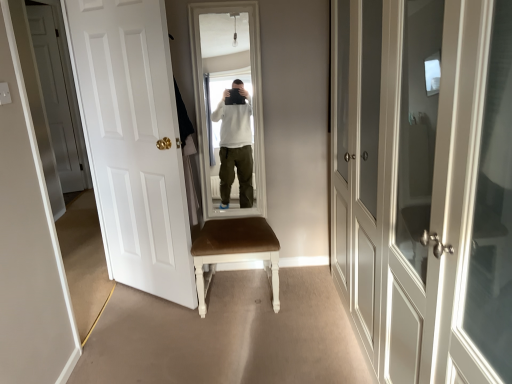
You are a GUI agent. You are given a task and a screenshot of the screen. Output one action in this format:
    pyautogui.click(x=<x>, y=<y>)
    Task: Click on the white glossy cabinet doors at right, placed as the first door when sorted from right to left
    Image resolution: width=512 pixels, height=384 pixels.
    Given the screenshot: What is the action you would take?
    pyautogui.click(x=424, y=185)

Identify the location of white glossy door at left, which ranks as the 2th door in front-to-back order. (133, 142).

Locate an element on the screen. The height and width of the screenshot is (384, 512). white matte door at left, acting as the first door starting from the back is located at coordinates (59, 95).

Is white glossy cabinet doors at right, which is the third door in back-to-front order, at the back of white glossy door at left, marked as the second door in a right-to-left arrangement?

No, white glossy door at left, marked as the second door in a right-to-left arrangement, is not facing the opposite direction of white glossy cabinet doors at right, which is the third door in back-to-front order.

Is white glossy door at left, the 2th door in the left-to-right sequence, to the left or to the right of white glossy cabinet doors at right, placed as the first door when sorted from front to back, in the image?

white glossy door at left, the 2th door in the left-to-right sequence, is positioned on white glossy cabinet doors at right, placed as the first door when sorted from front to back,'s left side.

Could you measure the distance between white glossy door at left, marked as the second door in a right-to-left arrangement, and white glossy cabinet doors at right, placed as the first door when sorted from front to back?

They are 1.32 meters apart.

Can you confirm if white glossy door at left, marked as the second door in a right-to-left arrangement, is taller than white glossy cabinet doors at right, the 3th door positioned from the left?

Yes.

Can you confirm if white glossy cabinet doors at right, placed as the first door when sorted from right to left, is taller than white matte door at left, which is the third door in right-to-left order?

No.

Is white glossy cabinet doors at right, which is the third door in back-to-front order, thinner than white matte door at left, acting as the first door starting from the back?

In fact, white glossy cabinet doors at right, which is the third door in back-to-front order, might be wider than white matte door at left, acting as the first door starting from the back.

Relative to white matte door at left, acting as the first door starting from the back, is white glossy cabinet doors at right, placed as the first door when sorted from front to back, in front or behind?

In the image, white glossy cabinet doors at right, placed as the first door when sorted from front to back, appears in front of white matte door at left, acting as the first door starting from the back.

Considering the sizes of objects white matte door at left, which is the third door in right-to-left order, and white glossy cabinet doors at right, placed as the first door when sorted from front to back, in the image provided, who is thinner, white matte door at left, which is the third door in right-to-left order, or white glossy cabinet doors at right, placed as the first door when sorted from front to back,?

With smaller width is white matte door at left, which is the third door in right-to-left order.

From the image's perspective, would you say white matte door at left, arranged as the third door when viewed from the front, is shown under white glossy cabinet doors at right, placed as the first door when sorted from right to left?

Incorrect, from the image's perspective, white matte door at left, arranged as the third door when viewed from the front, is higher than white glossy cabinet doors at right, placed as the first door when sorted from right to left.

Which is in front, point (67, 172) or point (397, 124)?

The point (397, 124) is in front.

In the image, is white matte door at left, acting as the first door starting from the back, positioned in front of or behind white glossy cabinet doors at right, the 3th door positioned from the left?

In the image, white matte door at left, acting as the first door starting from the back, appears behind white glossy cabinet doors at right, the 3th door positioned from the left.

Is brown leather chair at center situated inside white glossy cabinet doors at right, which is the third door in back-to-front order, or outside?

brown leather chair at center lies outside white glossy cabinet doors at right, which is the third door in back-to-front order.

You are a GUI agent. You are given a task and a screenshot of the screen. Output one action in this format:
    pyautogui.click(x=<x>, y=<y>)
    Task: Click on the 2nd door in front of the brown leather chair at center, starting your count from the anchor
    The height and width of the screenshot is (384, 512).
    Given the screenshot: What is the action you would take?
    pyautogui.click(x=424, y=185)

Considering the relative positions of brown leather chair at center and white glossy cabinet doors at right, which is the third door in back-to-front order, in the image provided, is brown leather chair at center behind white glossy cabinet doors at right, which is the third door in back-to-front order,?

Yes.

Which is behind, white matte door at left, acting as the first door starting from the back, or brown leather chair at center?

white matte door at left, acting as the first door starting from the back.

From a real-world perspective, does white matte door at left, the 1th door when ordered from left to right, sit lower than brown leather chair at center?

No, from a real-world perspective, white matte door at left, the 1th door when ordered from left to right, is not beneath brown leather chair at center.

Could you measure the distance between white matte door at left, arranged as the third door when viewed from the front, and white glossy door at left, marked as the second door in a right-to-left arrangement?

The distance of white matte door at left, arranged as the third door when viewed from the front, from white glossy door at left, marked as the second door in a right-to-left arrangement, is 6.60 feet.

Looking at this image, is white matte door at left, which is the third door in right-to-left order, thinner than white glossy door at left, the 2th door in the left-to-right sequence?

Yes, white matte door at left, which is the third door in right-to-left order, is thinner than white glossy door at left, the 2th door in the left-to-right sequence.

Is white matte door at left, the 1th door when ordered from left to right, at the left side of white glossy door at left, the 2th door in the left-to-right sequence?

Yes, white matte door at left, the 1th door when ordered from left to right, is to the left of white glossy door at left, the 2th door in the left-to-right sequence.

From a real-world perspective, is white matte door at left, the 1th door when ordered from left to right, located higher than white glossy door at left, which ranks as the 2th door in front-to-back order?

Correct, in the physical world, white matte door at left, the 1th door when ordered from left to right, is higher than white glossy door at left, which ranks as the 2th door in front-to-back order.

Considering the relative sizes of brown leather chair at center and white glossy door at left, marked as the second door in a right-to-left arrangement, in the image provided, is brown leather chair at center bigger than white glossy door at left, marked as the second door in a right-to-left arrangement,?

Correct, brown leather chair at center is larger in size than white glossy door at left, marked as the second door in a right-to-left arrangement.

Is brown leather chair at center taller than white glossy door at left, marked as the second door in a right-to-left arrangement?

No, brown leather chair at center is not taller than white glossy door at left, marked as the second door in a right-to-left arrangement.

Is brown leather chair at center further to camera compared to white glossy door at left, acting as the second door starting from the back?

Yes, brown leather chair at center is further from the camera.

Does brown leather chair at center turn towards white glossy door at left, the 2th door in the left-to-right sequence?

No, brown leather chair at center is not turned towards white glossy door at left, the 2th door in the left-to-right sequence.

Locate an element on the screen. the 1st door directly above the white glossy cabinet doors at right, placed as the first door when sorted from right to left (from a real-world perspective) is located at coordinates (133, 142).

From the image's perspective, count 2nd doors downward from the white matte door at left, arranged as the third door when viewed from the front, and point to it. Please provide its 2D coordinates.

[(424, 185)]

When comparing their distances from white glossy door at left, the 2th door in the left-to-right sequence, does white matte door at left, acting as the first door starting from the back, or brown leather chair at center seem further?

white matte door at left, acting as the first door starting from the back.

Estimate the real-world distances between objects in this image. Which object is closer to brown leather chair at center, white glossy cabinet doors at right, placed as the first door when sorted from right to left, or white glossy door at left, acting as the second door starting from the back?

white glossy door at left, acting as the second door starting from the back, is positioned closer to the anchor brown leather chair at center.

Estimate the real-world distances between objects in this image. Which object is further from brown leather chair at center, white matte door at left, the 1th door when ordered from left to right, or white glossy door at left, which ranks as the 2th door in front-to-back order?

Among the two, white matte door at left, the 1th door when ordered from left to right, is located further to brown leather chair at center.

Looking at the image, which one is located closer to white glossy door at left, marked as the second door in a right-to-left arrangement, white matte door at left, acting as the first door starting from the back, or white glossy cabinet doors at right, the 3th door positioned from the left?

white glossy cabinet doors at right, the 3th door positioned from the left.

Looking at this image, looking at the image, which one is located further to white glossy cabinet doors at right, placed as the first door when sorted from front to back, white glossy door at left, acting as the second door starting from the back, or white matte door at left, which is the third door in right-to-left order?

white matte door at left, which is the third door in right-to-left order, lies further to white glossy cabinet doors at right, placed as the first door when sorted from front to back, than the other object.

Estimate the real-world distances between objects in this image. Which object is closer to brown leather chair at center, white glossy door at left, acting as the second door starting from the back, or white matte door at left, the 1th door when ordered from left to right?

white glossy door at left, acting as the second door starting from the back.

Looking at the image, which one is located further to white glossy door at left, marked as the second door in a right-to-left arrangement, brown leather chair at center or white glossy cabinet doors at right, placed as the first door when sorted from right to left?

Based on the image, white glossy cabinet doors at right, placed as the first door when sorted from right to left, appears to be further to white glossy door at left, marked as the second door in a right-to-left arrangement.

Considering their positions, is white glossy door at left, the 2th door in the left-to-right sequence, positioned further to white matte door at left, which is the third door in right-to-left order, than white glossy cabinet doors at right, placed as the first door when sorted from right to left?

white glossy cabinet doors at right, placed as the first door when sorted from right to left, lies further to white matte door at left, which is the third door in right-to-left order, than the other object.

Locate an element on the screen. door between white glossy cabinet doors at right, the 3th door positioned from the left, and white matte door at left, which is the third door in right-to-left order, from front to back is located at coordinates (133, 142).

What are the coordinates of `chair between white glossy cabinet doors at right, placed as the first door when sorted from right to left, and white matte door at left, acting as the first door starting from the back, from front to back` in the screenshot? It's located at tap(234, 251).

I want to click on chair between white glossy door at left, which ranks as the 2th door in front-to-back order, and white matte door at left, the 1th door when ordered from left to right, along the z-axis, so click(x=234, y=251).

Locate an element on the screen. The width and height of the screenshot is (512, 384). door between white glossy cabinet doors at right, placed as the first door when sorted from right to left, and brown leather chair at center, along the z-axis is located at coordinates (133, 142).